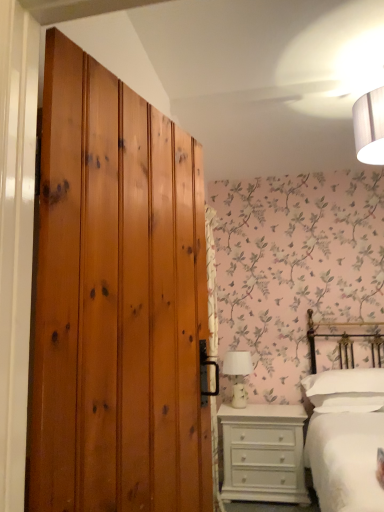
Question: Would you consider white ceramic table lamp at center to be distant from wooden wardrobe at left?

Choices:
 (A) no
 (B) yes

Answer: (B)

Question: From the image's perspective, is white ceramic table lamp at center above wooden wardrobe at left?

Choices:
 (A) no
 (B) yes

Answer: (A)

Question: From the image's perspective, does white ceramic table lamp at center appear lower than wooden wardrobe at left?

Choices:
 (A) yes
 (B) no

Answer: (A)

Question: Is white ceramic table lamp at center beside wooden wardrobe at left?

Choices:
 (A) yes
 (B) no

Answer: (B)

Question: Can you confirm if white ceramic table lamp at center is smaller than wooden wardrobe at left?

Choices:
 (A) yes
 (B) no

Answer: (A)

Question: Can you confirm if white ceramic table lamp at center is positioned to the right of wooden wardrobe at left?

Choices:
 (A) yes
 (B) no

Answer: (A)

Question: Is wooden wardrobe at left shorter than white ceramic table lamp at center?

Choices:
 (A) no
 (B) yes

Answer: (A)

Question: Considering the relative sizes of wooden wardrobe at left and white ceramic table lamp at center in the image provided, is wooden wardrobe at left bigger than white ceramic table lamp at center?

Choices:
 (A) no
 (B) yes

Answer: (B)

Question: Is wooden wardrobe at left positioned beyond the bounds of white ceramic table lamp at center?

Choices:
 (A) no
 (B) yes

Answer: (B)

Question: Is wooden wardrobe at left to the right of white ceramic table lamp at center from the viewer's perspective?

Choices:
 (A) no
 (B) yes

Answer: (A)

Question: Is wooden wardrobe at left taller than white ceramic table lamp at center?

Choices:
 (A) no
 (B) yes

Answer: (B)

Question: Is wooden wardrobe at left positioned in front of white ceramic table lamp at center?

Choices:
 (A) yes
 (B) no

Answer: (A)

Question: Can white painted wood chest of drawers at lower right be found inside white cotton bed at right?

Choices:
 (A) no
 (B) yes

Answer: (A)